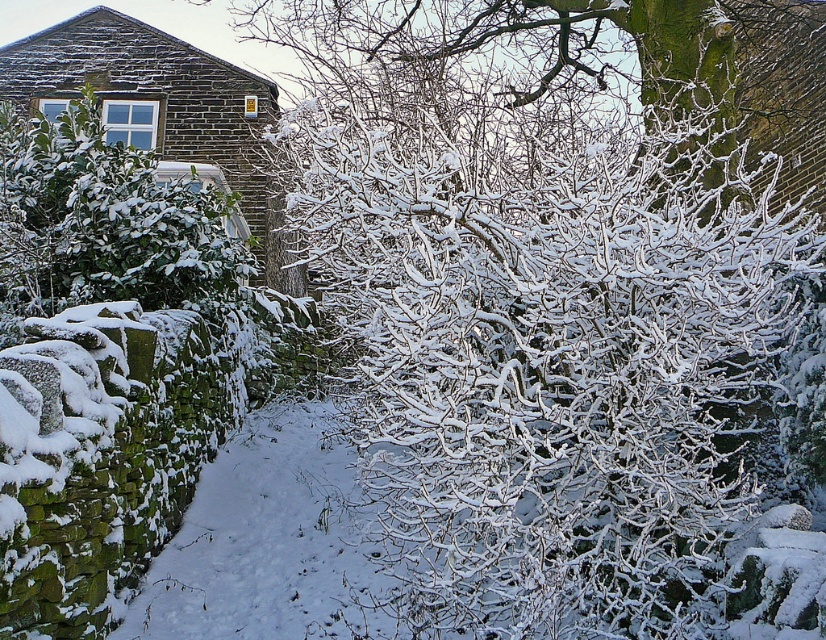
You are standing at the center of the image and want to locate the green leafy bush at upper left. Which direction should you face to see it?

You should face the upper left direction to see the green leafy bush at upper left, as it is located at point [102,221].